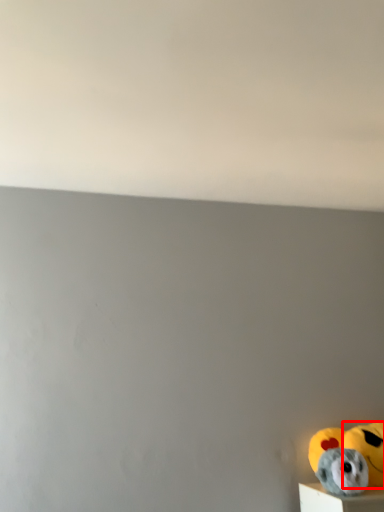
Question: From the image's perspective, what is the correct spatial positioning of stuffed animal (annotated by the red box) in reference to toy?

Choices:
 (A) above
 (B) below

Answer: (B)